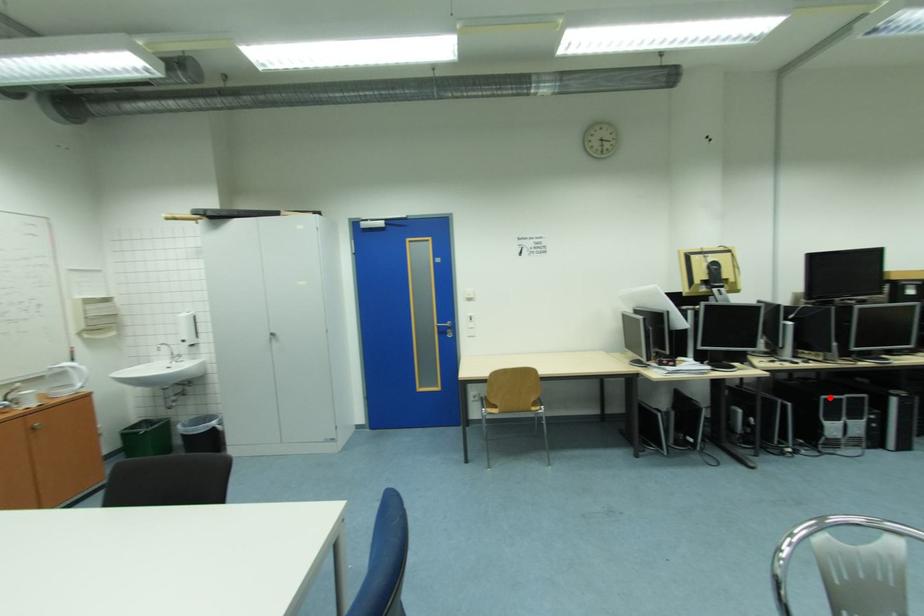
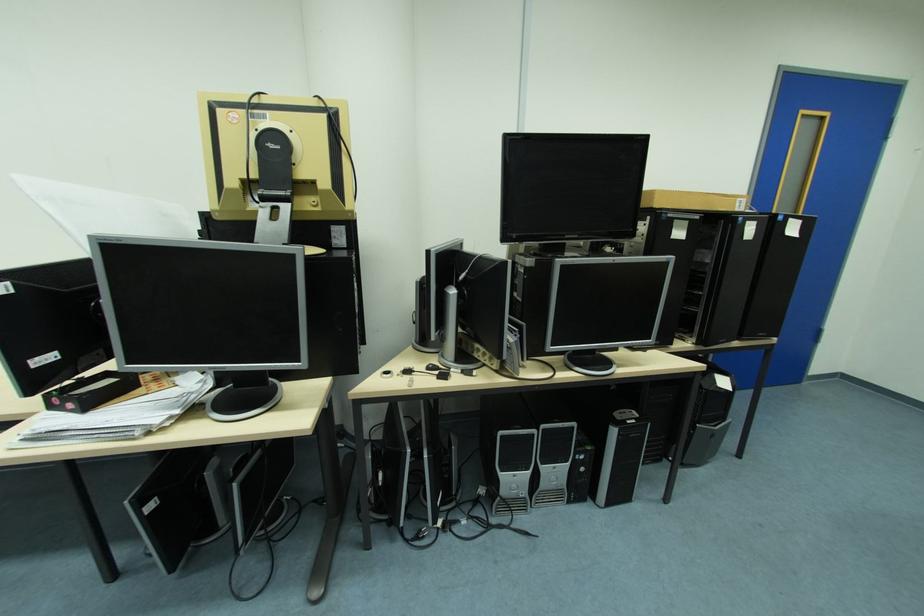
Question: A red point is marked in image1. In image2, is the corresponding 3D point closer to the camera or farther? Reply with the corresponding letter.

Choices:
 (A) The corresponding 3D point is closer.
 (B) The corresponding 3D point is farther.

Answer: (B)